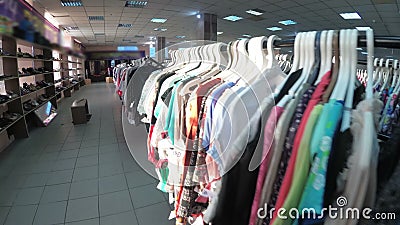
At what (x,y) coordinates should I click in order to perform the action: click on drop ceiling tile. Please return your answer as a coordinate pair (x, y). Image resolution: width=400 pixels, height=225 pixels. Looking at the image, I should click on (131, 16), (174, 12), (79, 22).